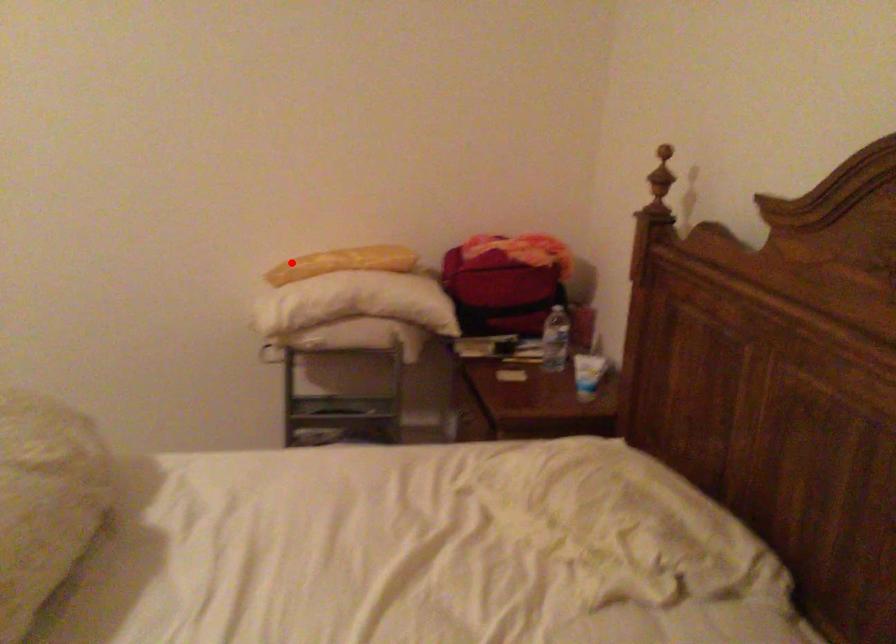
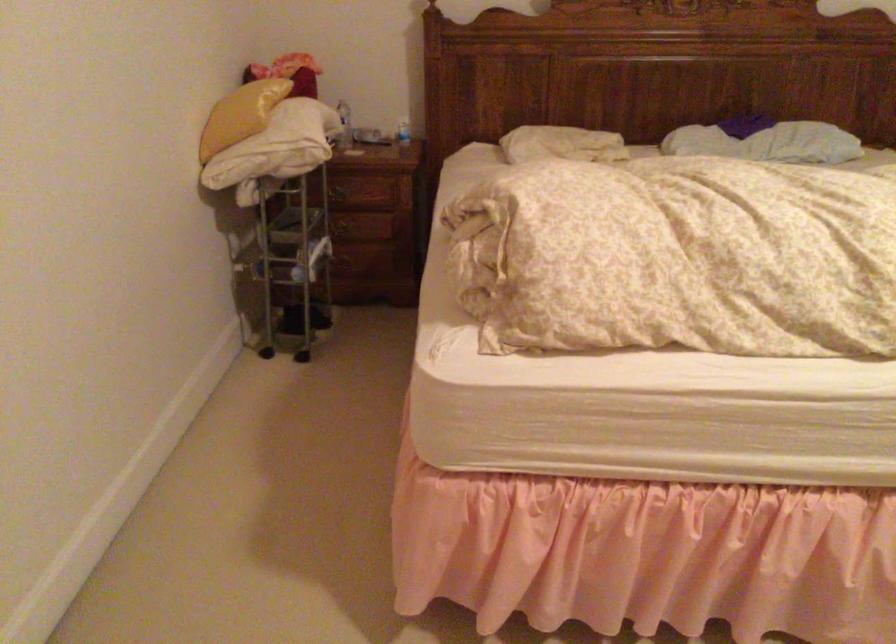
Question: I am providing you with two images of the same scene from different viewpoints. Given a red point in image1, look at the same physical point in image2. Is it:

Choices:
 (A) Closer to the viewpoint
 (B) Farther from the viewpoint

Answer: (B)